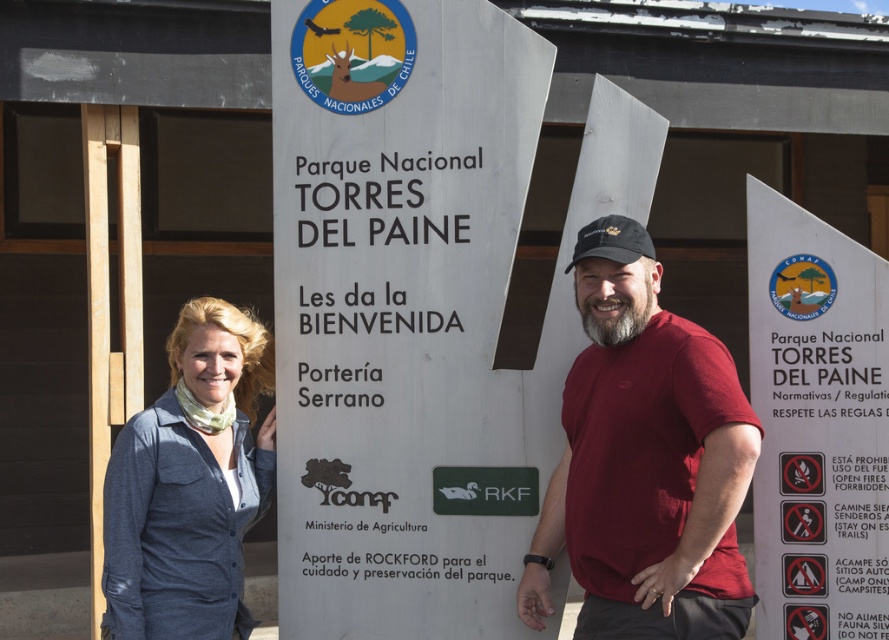
You are a photographer who wants to capture both the silver metallic sign at center and the denim shirt at center in one frame. Based on their sizes, which object should you focus on to ensure both are clearly visible?

The silver metallic sign at center is much taller than the denim shirt at center, so to capture both clearly, focus on the silver metallic sign at center as it is the larger object and will require more space in the frame.